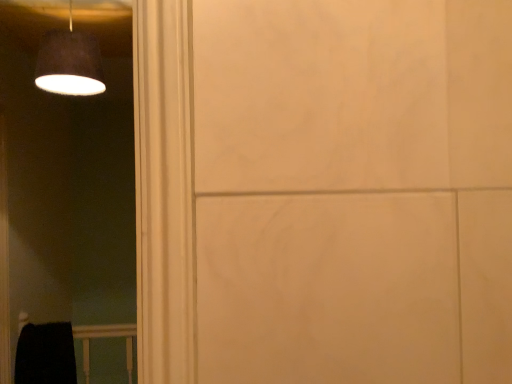
The image size is (512, 384). What do you see at coordinates (69, 63) in the screenshot? I see `matte black lampshade at upper left` at bounding box center [69, 63].

Image resolution: width=512 pixels, height=384 pixels. What are the coordinates of `matte black lampshade at upper left` in the screenshot? It's located at (69, 63).

At what (x,y) coordinates should I click in order to perform the action: click on black matte balustrade at lower left. Please return your answer as a coordinate pair (x, y). The image size is (512, 384). Looking at the image, I should click on 64,351.

What is the approximate width of black matte balustrade at lower left?

9.27 centimeters.

What do you see at coordinates (64, 351) in the screenshot? I see `black matte balustrade at lower left` at bounding box center [64, 351].

This screenshot has width=512, height=384. Find the location of `matte black lampshade at upper left`. matte black lampshade at upper left is located at coordinates (69, 63).

Which is more to the left, black matte balustrade at lower left or matte black lampshade at upper left?

From the viewer's perspective, black matte balustrade at lower left appears more on the left side.

Is black matte balustrade at lower left further to the viewer compared to matte black lampshade at upper left?

Yes, the depth of black matte balustrade at lower left is greater than that of matte black lampshade at upper left.

Between point (56, 325) and point (91, 61), which one is positioned in front?

Point (91, 61)

From the image's perspective, which is below, black matte balustrade at lower left or matte black lampshade at upper left?

black matte balustrade at lower left.

From a real-world perspective, which is physically above, black matte balustrade at lower left or matte black lampshade at upper left?

matte black lampshade at upper left, from a real-world perspective.

Is black matte balustrade at lower left thinner than matte black lampshade at upper left?

Indeed, black matte balustrade at lower left has a lesser width compared to matte black lampshade at upper left.

Does black matte balustrade at lower left have a lesser height compared to matte black lampshade at upper left?

In fact, black matte balustrade at lower left may be taller than matte black lampshade at upper left.

Between black matte balustrade at lower left and matte black lampshade at upper left, which one has larger size?

Bigger between the two is black matte balustrade at lower left.

Do you think black matte balustrade at lower left is within matte black lampshade at upper left, or outside of it?

The correct answer is: outside.

Is black matte balustrade at lower left touching matte black lampshade at upper left?

They are not placed beside each other.

Could you tell me if black matte balustrade at lower left is turned towards matte black lampshade at upper left?

No, black matte balustrade at lower left is not turned towards matte black lampshade at upper left.

What are the coordinates of `lamp on the right of black matte balustrade at lower left` in the screenshot? It's located at (69, 63).

Which object is positioned more to the left, matte black lampshade at upper left or black matte balustrade at lower left?

From the viewer's perspective, black matte balustrade at lower left appears more on the left side.

Is matte black lampshade at upper left further to camera compared to black matte balustrade at lower left?

No, the depth of matte black lampshade at upper left is less than that of black matte balustrade at lower left.

Is point (61, 33) closer to viewer compared to point (52, 364)?

Yes, it is.

From the image's perspective, is matte black lampshade at upper left below black matte balustrade at lower left?

Incorrect, from the image's perspective, matte black lampshade at upper left is higher than black matte balustrade at lower left.

From a real-world perspective, relative to black matte balustrade at lower left, is matte black lampshade at upper left vertically above or below?

matte black lampshade at upper left is situated higher than black matte balustrade at lower left in the real world.

Can you confirm if matte black lampshade at upper left is thinner than black matte balustrade at lower left?

In fact, matte black lampshade at upper left might be wider than black matte balustrade at lower left.

Does matte black lampshade at upper left have a lesser height compared to black matte balustrade at lower left?

Yes, matte black lampshade at upper left is shorter than black matte balustrade at lower left.

Can you confirm if matte black lampshade at upper left is smaller than black matte balustrade at lower left?

Correct, matte black lampshade at upper left occupies less space than black matte balustrade at lower left.

Based on the photo, is matte black lampshade at upper left not within black matte balustrade at lower left?

matte black lampshade at upper left lies outside black matte balustrade at lower left's area.

Based on the photo, does matte black lampshade at upper left touch black matte balustrade at lower left?

No.

Does matte black lampshade at upper left turn towards black matte balustrade at lower left?

Result: No, matte black lampshade at upper left does not turn towards black matte balustrade at lower left.

The height and width of the screenshot is (384, 512). Find the location of `balustrade that appears below the matte black lampshade at upper left (from a real-world perspective)`. balustrade that appears below the matte black lampshade at upper left (from a real-world perspective) is located at coordinates (64, 351).

Where is `lamp that appears above the black matte balustrade at lower left (from the image's perspective)`? lamp that appears above the black matte balustrade at lower left (from the image's perspective) is located at coordinates (69, 63).

Identify the location of balustrade on the left of matte black lampshade at upper left. This screenshot has height=384, width=512. 64,351.